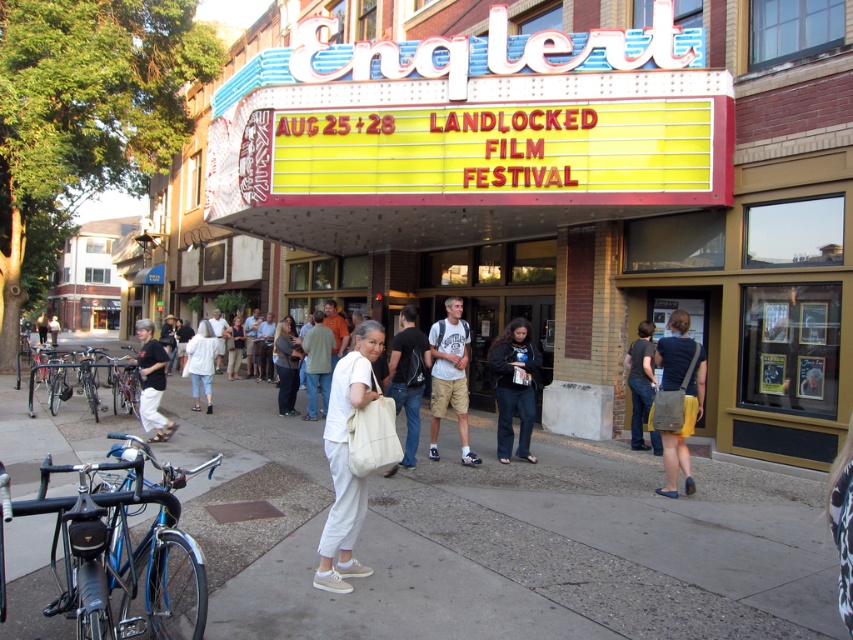
Question: Where is yellow canvas bag at lower right located in relation to dark blue shirt at center in the image?

Choices:
 (A) right
 (B) left

Answer: (B)

Question: Does gray concrete sidewalk at center appear over yellow canvas bag at lower right?

Choices:
 (A) yes
 (B) no

Answer: (B)

Question: Which point is farther to the camera?

Choices:
 (A) (236, 452)
 (B) (529, 433)

Answer: (A)

Question: Which of the following is the farthest from the observer?

Choices:
 (A) dark blue shirt at center
 (B) black cotton shirt at left
 (C) gray concrete sidewalk at center
 (D) light brown shorts at center

Answer: (A)

Question: Among these points, which one is farthest from the camera?

Choices:
 (A) (403, 467)
 (B) (233, 524)

Answer: (A)

Question: Is light brown shorts at center smaller than white cotton shirt at center?

Choices:
 (A) yes
 (B) no

Answer: (A)